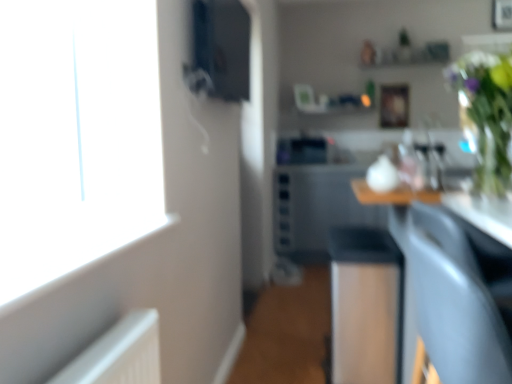
Question: From a real-world perspective, does black glossy sink at center sit lower than green glass vase at upper right?

Choices:
 (A) no
 (B) yes

Answer: (B)

Question: Is black glossy sink at center positioned with its back to green glass vase at upper right?

Choices:
 (A) no
 (B) yes

Answer: (A)

Question: Is black glossy sink at center in front of green glass vase at upper right?

Choices:
 (A) yes
 (B) no

Answer: (B)

Question: Does black glossy sink at center lie behind green glass vase at upper right?

Choices:
 (A) no
 (B) yes

Answer: (B)

Question: From a real-world perspective, does black glossy sink at center stand above green glass vase at upper right?

Choices:
 (A) yes
 (B) no

Answer: (B)

Question: Can you confirm if black glossy sink at center is positioned to the left of green glass vase at upper right?

Choices:
 (A) yes
 (B) no

Answer: (A)

Question: Is matte gray armchair at lower right at the left side of black glossy sink at center?

Choices:
 (A) yes
 (B) no

Answer: (B)

Question: Does matte gray armchair at lower right have a smaller size compared to black glossy sink at center?

Choices:
 (A) no
 (B) yes

Answer: (A)

Question: Can you confirm if matte gray armchair at lower right is positioned to the right of black glossy sink at center?

Choices:
 (A) yes
 (B) no

Answer: (A)

Question: From a real-world perspective, is matte gray armchair at lower right beneath black glossy sink at center?

Choices:
 (A) yes
 (B) no

Answer: (A)

Question: Does matte gray armchair at lower right turn towards black glossy sink at center?

Choices:
 (A) no
 (B) yes

Answer: (A)

Question: Can you confirm if matte gray armchair at lower right is shorter than black glossy sink at center?

Choices:
 (A) no
 (B) yes

Answer: (A)

Question: Is matte black speaker at upper center at the back of wooden picture frame at upper center?

Choices:
 (A) no
 (B) yes

Answer: (A)